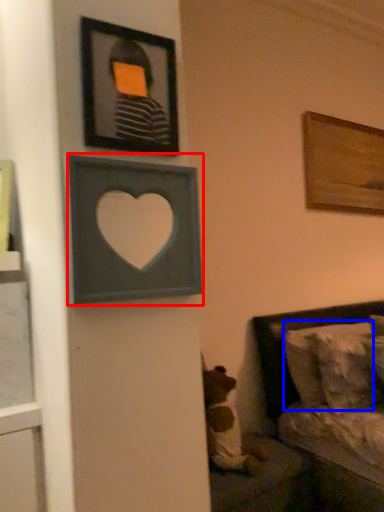
Question: Among these objects, which one is farthest to the camera, picture frame (highlighted by a red box) or pillow (highlighted by a blue box)?

Choices:
 (A) picture frame
 (B) pillow

Answer: (B)